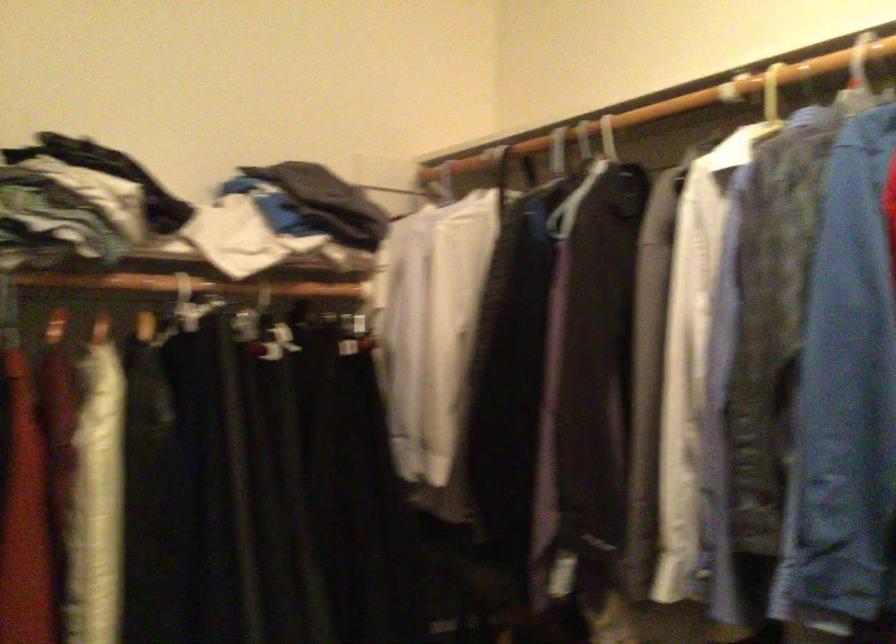
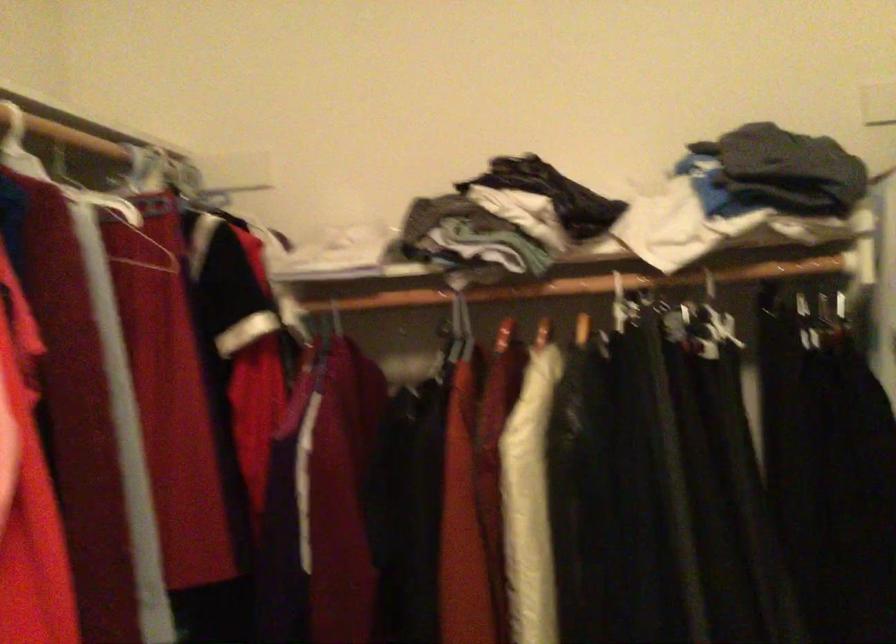
Question: The camera is either moving clockwise (left) or counter-clockwise (right) around the object. The first image is from the beginning of the video and the second image is from the end. Is the camera moving left or right when shooting the video?

Choices:
 (A) Left
 (B) Right

Answer: (B)